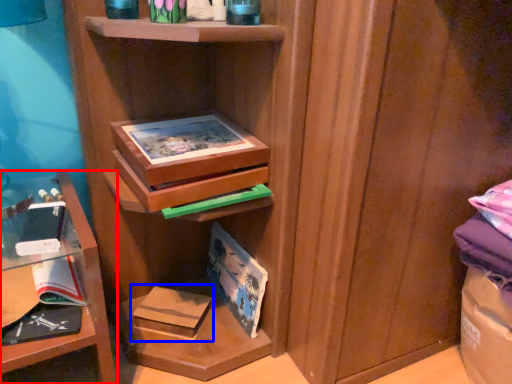
Question: Which of the following is the farthest to the observer, shelf (highlighted by a red box) or paperback book (highlighted by a blue box)?

Choices:
 (A) shelf
 (B) paperback book

Answer: (B)